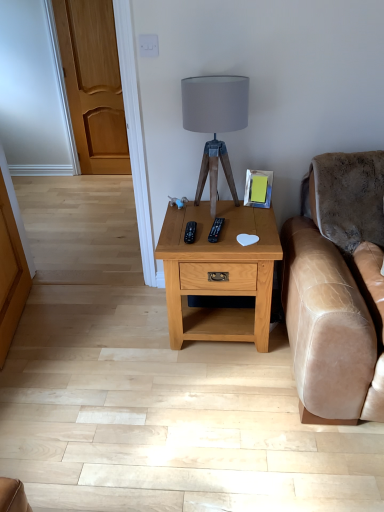
Where is `unoccupied region to the right of black plastic remote at center, which is counted as the second remote, starting from the right`? This screenshot has width=384, height=512. unoccupied region to the right of black plastic remote at center, which is counted as the second remote, starting from the right is located at coordinates (235, 230).